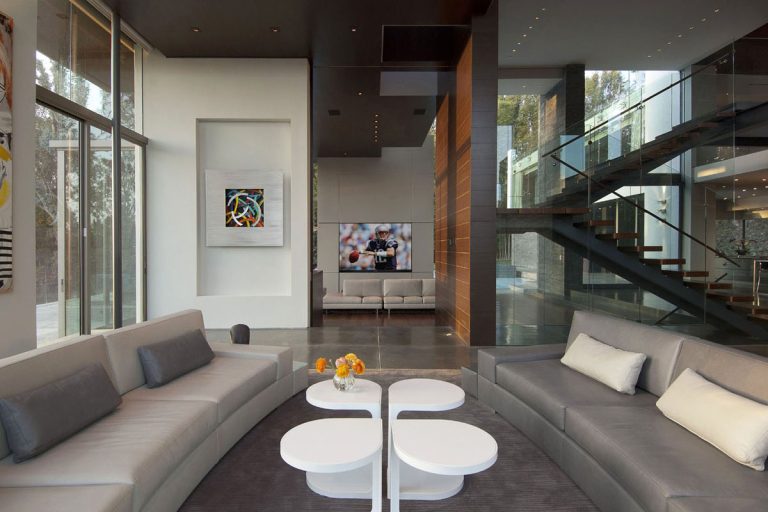
Locate an element on the screen. Image resolution: width=768 pixels, height=512 pixels. carpet is located at coordinates (520, 466).